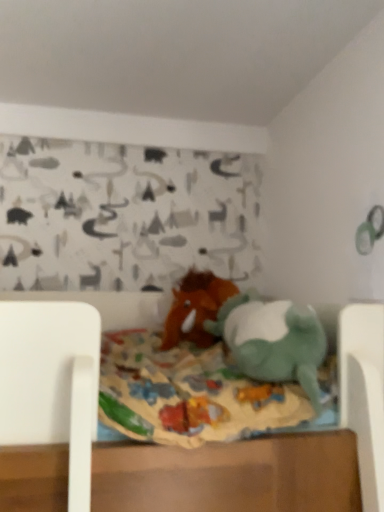
Question: From a real-world perspective, is brown plush horse at center, acting as the first toy starting from the back, positioned above or below green plush toy at center, the 1th toy from the front?

Choices:
 (A) below
 (B) above

Answer: (B)

Question: Considering the positions of brown plush horse at center, acting as the first toy starting from the back, and green plush toy at center, the 1th toy from the front, in the image, is brown plush horse at center, acting as the first toy starting from the back, wider or thinner than green plush toy at center, the 1th toy from the front,?

Choices:
 (A) thin
 (B) wide

Answer: (B)

Question: Is brown plush horse at center, acting as the first toy starting from the back, taller or shorter than green plush toy at center, the 1th toy from the front?

Choices:
 (A) short
 (B) tall

Answer: (B)

Question: Considering the positions of green plush toy at center, arranged as the 2th toy when viewed from the back, and brown plush horse at center, arranged as the second toy when viewed from the front, in the image, is green plush toy at center, arranged as the 2th toy when viewed from the back, wider or thinner than brown plush horse at center, arranged as the second toy when viewed from the front,?

Choices:
 (A) wide
 (B) thin

Answer: (B)

Question: Is point (284, 323) positioned closer to the camera than point (195, 330)?

Choices:
 (A) closer
 (B) farther

Answer: (A)

Question: In terms of height, does green plush toy at center, arranged as the 2th toy when viewed from the back, look taller or shorter compared to brown plush horse at center, acting as the first toy starting from the back?

Choices:
 (A) short
 (B) tall

Answer: (A)

Question: Considering their positions, is green plush toy at center, arranged as the 2th toy when viewed from the back, located in front of or behind brown plush horse at center, acting as the first toy starting from the back?

Choices:
 (A) front
 (B) behind

Answer: (A)